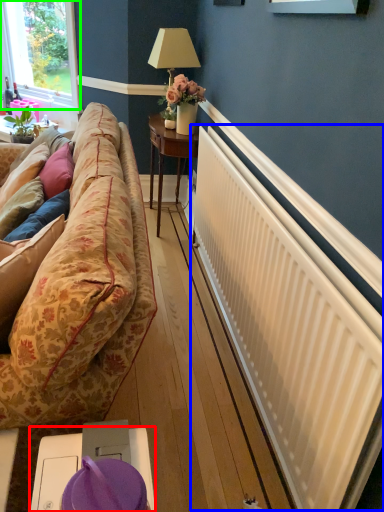
Question: Based on their relative distances, which object is nearer to table (highlighted by a red box)? Choose from radiator (highlighted by a blue box) and window (highlighted by a green box).

Choices:
 (A) radiator
 (B) window

Answer: (A)